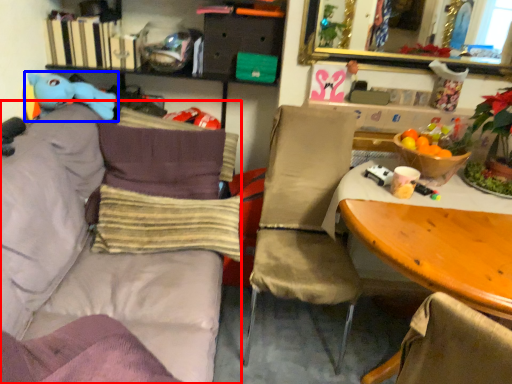
Question: Among these objects, which one is farthest to the camera, studio couch (highlighted by a red box) or toy (highlighted by a blue box)?

Choices:
 (A) studio couch
 (B) toy

Answer: (B)